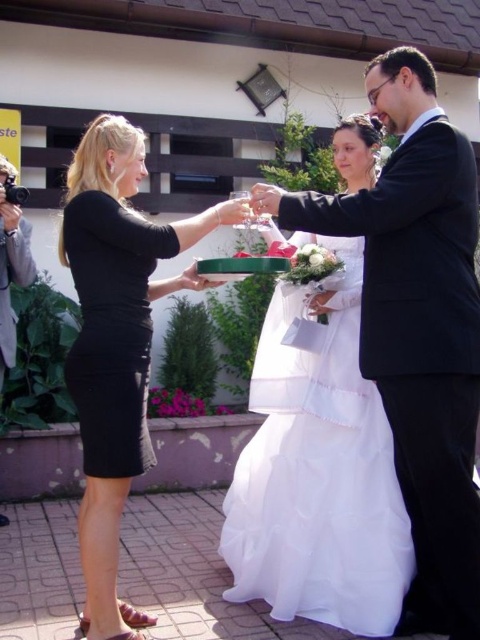
Measure the distance from white satin dress at center to matte black camera at left.

The distance of white satin dress at center from matte black camera at left is 6.26 feet.

Is white satin dress at center positioned behind matte black camera at left?

No, it is not.

What do you see at coordinates (317, 468) in the screenshot? This screenshot has height=640, width=480. I see `white satin dress at center` at bounding box center [317, 468].

Image resolution: width=480 pixels, height=640 pixels. I want to click on white satin dress at center, so click(x=317, y=468).

Does black satin suit at center have a greater height compared to black matte dress at left?

Correct, black satin suit at center is much taller as black matte dress at left.

Does black satin suit at center come behind black matte dress at left?

No, black satin suit at center is in front of black matte dress at left.

The width and height of the screenshot is (480, 640). What do you see at coordinates (418, 323) in the screenshot?
I see `black satin suit at center` at bounding box center [418, 323].

Where is `black satin suit at center`? The width and height of the screenshot is (480, 640). black satin suit at center is located at coordinates (418, 323).

Which is below, black matte dress at center or black matte dress at left?

black matte dress at center is lower down.

Describe the element at coordinates (117, 342) in the screenshot. The height and width of the screenshot is (640, 480). I see `black matte dress at center` at that location.

Does point (87, 624) lie in front of point (134, 225)?

No, it is not.

Locate an element on the screen. black matte dress at center is located at coordinates (117, 342).